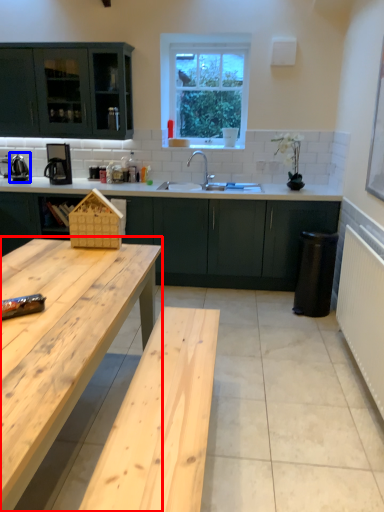
Question: Which of the following is the farthest to the observer, table (highlighted by a red box) or appliance (highlighted by a blue box)?

Choices:
 (A) table
 (B) appliance

Answer: (B)